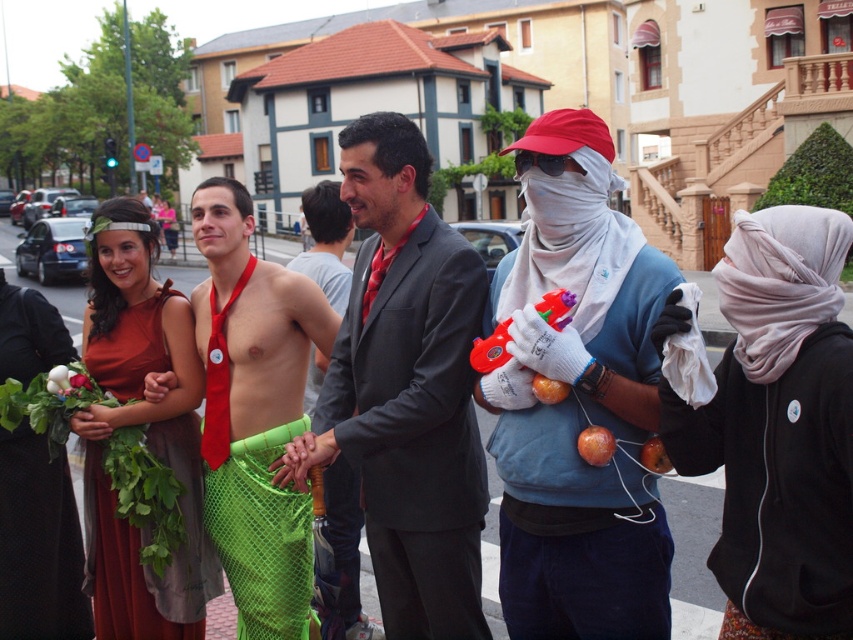
Question: Estimate the real-world distances between objects in this image. Which object is closer to the green mesh skirt at center?

Choices:
 (A) matte red dress at center
 (B) shiny black suit at center
 (C) shiny red apple at center

Answer: (A)

Question: Estimate the real-world distances between objects in this image. Which object is farther from the ripe red apple at center?

Choices:
 (A) shiny red apple at center
 (B) light gray fabric scarf at right

Answer: (B)

Question: Is dark gray suit at center to the left of green mesh skirt at center from the viewer's perspective?

Choices:
 (A) yes
 (B) no

Answer: (B)

Question: Can you confirm if shiny red apple at center is smaller than ripe red apple at center?

Choices:
 (A) no
 (B) yes

Answer: (A)

Question: Is dark gray suit at center smaller than orange matte apple at center?

Choices:
 (A) yes
 (B) no

Answer: (B)

Question: Considering the real-world distances, which object is farthest from the shiny red apple at center?

Choices:
 (A) green leafy vegetable at lower left
 (B) ripe red apple at center
 (C) orange matte apple at center
 (D) white cotton gloves at center

Answer: (A)